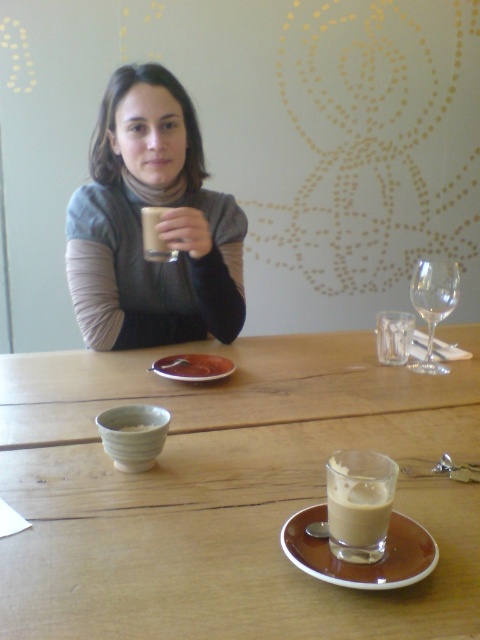
Question: Estimate the real-world distances between objects in this image. Which object is closer to the wooden table at center?

Choices:
 (A) brown ceramic saucer at center
 (B) matte plastic cup at upper center
 (C) matte ceramic bowl at lower left
 (D) white frothy beverage at center

Answer: (A)

Question: From the image, what is the correct spatial relationship of matte plastic cup at upper center in relation to matte ceramic bowl at lower left?

Choices:
 (A) above
 (B) below

Answer: (A)

Question: Which object is closer to the camera taking this photo?

Choices:
 (A) matte ceramic bowl at lower left
 (B) white frothy beverage at center
 (C) brown ceramic saucer at lower center

Answer: (C)

Question: Does matte plastic cup at upper center have a larger size compared to matte ceramic bowl at lower left?

Choices:
 (A) no
 (B) yes

Answer: (B)

Question: Is white frothy beverage at center to the right of matte ceramic bowl at lower left from the viewer's perspective?

Choices:
 (A) yes
 (B) no

Answer: (A)

Question: Estimate the real-world distances between objects in this image. Which object is closer to the transparent glass wine glass at right?

Choices:
 (A) wooden table at center
 (B) white frothy beverage at center
 (C) matte gray sweater at upper center
 (D) matte plastic cup at upper center

Answer: (A)